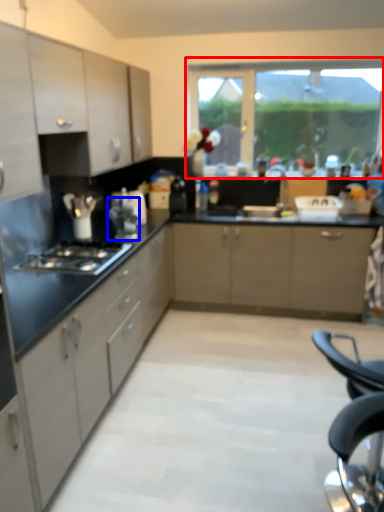
Question: Which point is closer to the camera, window (highlighted by a red box) or appliance (highlighted by a blue box)?

Choices:
 (A) window
 (B) appliance

Answer: (B)